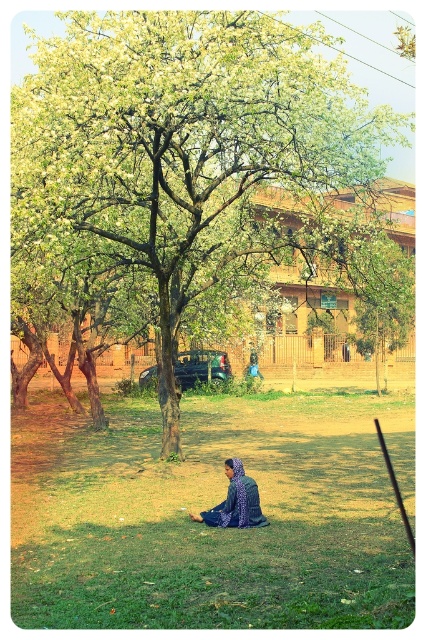
Based on the scene described, which object occupies a larger area in the image? Please refer to the objects listed below for your answer. Objects available for selection are green leafy tree at center and blue patterned dress at center.

The green leafy tree at center is bigger than the blue patterned dress at center, so the green leafy tree at center occupies a larger area in the image.

You are a photographer standing in front of the green leafy tree at center and the blue patterned dress at center. Which object is closer to you?

The green leafy tree at center is closer to you than the blue patterned dress at center.